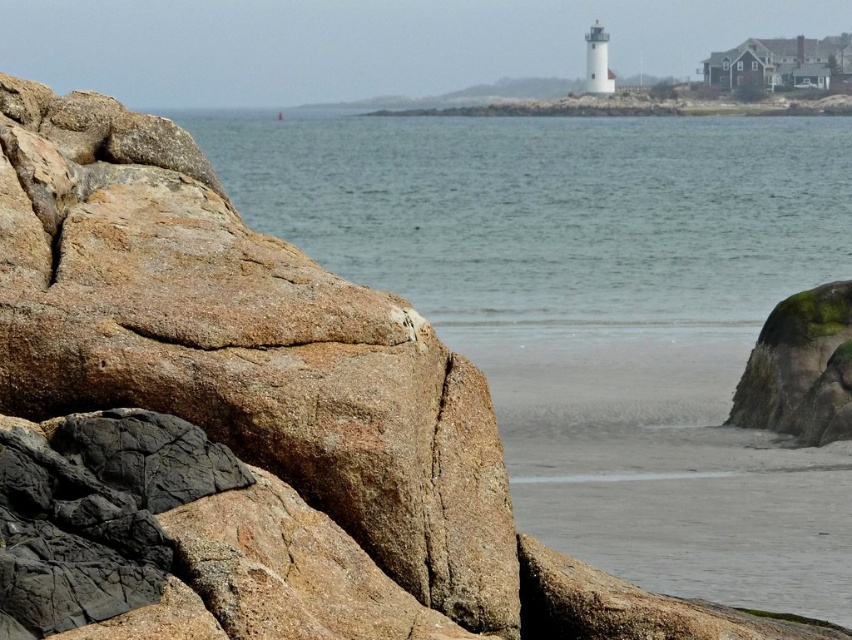
Question: Can you confirm if clear water at center is thinner than green mossy rock at lower right?

Choices:
 (A) yes
 (B) no

Answer: (B)

Question: Which point is closer to the camera taking this photo?

Choices:
 (A) (560, 312)
 (B) (749, 422)
 (C) (363, 419)

Answer: (C)

Question: Is clear water at center to the right of green mossy rock at lower right from the viewer's perspective?

Choices:
 (A) no
 (B) yes

Answer: (A)

Question: Which is farther from the clear water at center?

Choices:
 (A) brown rough rock at left
 (B) green mossy rock at lower right

Answer: (A)

Question: Is clear water at center to the left of green mossy rock at lower right from the viewer's perspective?

Choices:
 (A) no
 (B) yes

Answer: (B)

Question: Which of the following is the closest to the observer?

Choices:
 (A) (775, 330)
 (B) (60, 136)

Answer: (B)